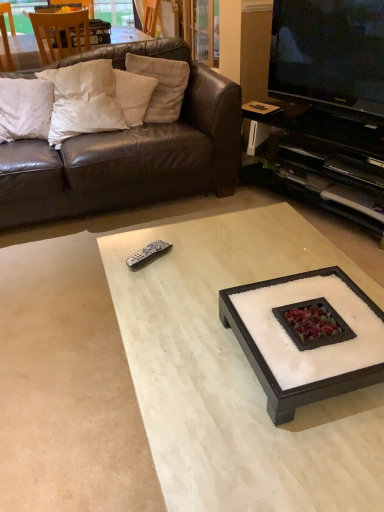
Locate an element on the screen. This screenshot has height=512, width=384. free space to the back side of white marble coffee table at center, which is the second coffee table in bottom-to-top order is located at coordinates click(255, 262).